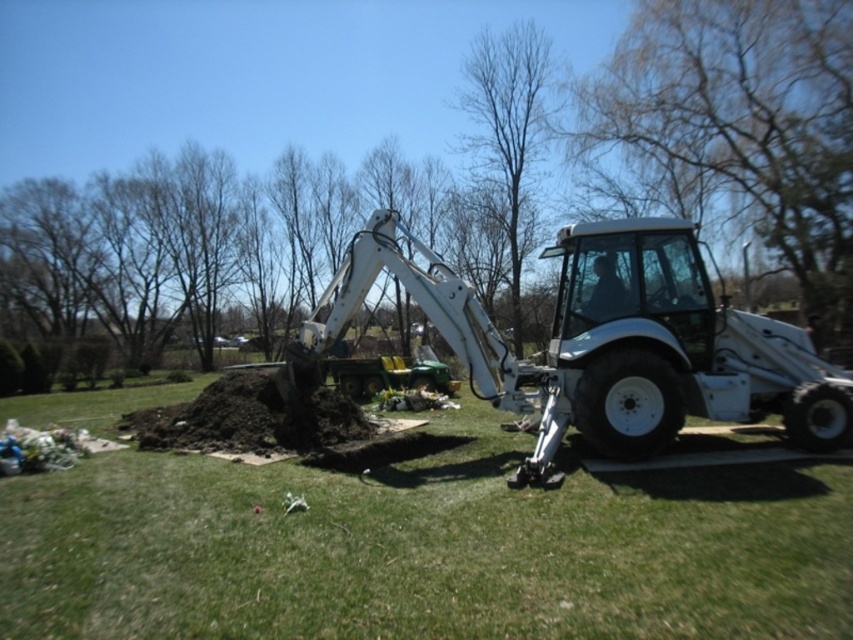
Does green grass at center lie behind white matte tractor at center?

No.

Is green grass at center closer to the viewer compared to white matte tractor at center?

Yes, green grass at center is closer to the viewer.

Is point (567, 572) positioned in front of point (637, 346)?

Yes, point (567, 572) is closer to viewer.

Locate an element on the screen. green grass at center is located at coordinates (425, 547).

Is brown leafless tree at center to the left of bare branches at center from the viewer's perspective?

Correct, you'll find brown leafless tree at center to the left of bare branches at center.

Is brown leafless tree at center thinner than bare branches at center?

No, brown leafless tree at center is not thinner than bare branches at center.

Between point (85, 259) and point (495, 64), which one is positioned behind?

The point (85, 259) is more distant.

Image resolution: width=853 pixels, height=640 pixels. Find the location of `brown leafless tree at center`. brown leafless tree at center is located at coordinates (476, 184).

Where is `green grass at center`? This screenshot has width=853, height=640. green grass at center is located at coordinates (425, 547).

Does green grass at center come in front of bare branches at center?

That is True.

Locate an element on the screen. The image size is (853, 640). green grass at center is located at coordinates (425, 547).